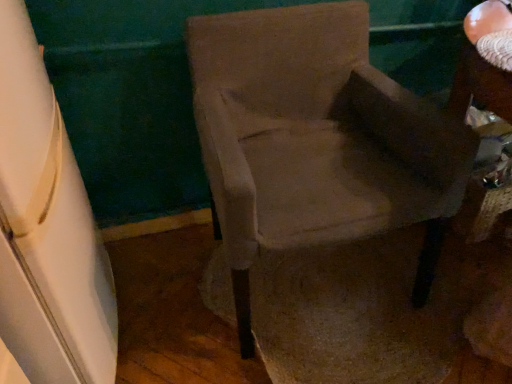
Locate an element on the screen. suede-like beige chair at center is located at coordinates (316, 139).

The image size is (512, 384). What do you see at coordinates (316, 139) in the screenshot?
I see `suede-like beige chair at center` at bounding box center [316, 139].

Find the location of a particular element. This screenshot has height=384, width=512. suede-like beige chair at center is located at coordinates coord(316,139).